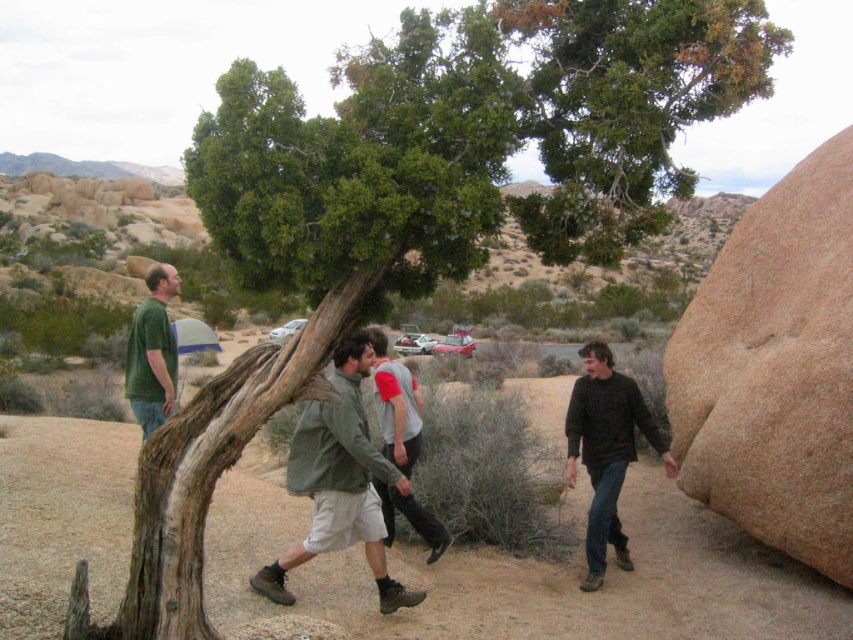
Question: Considering the real-world distances, which object is closest to the green fabric jacket at center?

Choices:
 (A) brown rough rock at right
 (B) dark gray sweater at right
 (C) gray-green fabric jacket at center

Answer: (C)

Question: Is brown rough rock at right below green matte shirt at center?

Choices:
 (A) no
 (B) yes

Answer: (B)

Question: Can you confirm if brown rough rock at right is positioned above green fabric jacket at center?

Choices:
 (A) no
 (B) yes

Answer: (B)

Question: Based on their relative distances, which object is farther from the dark gray sweater at right?

Choices:
 (A) green matte shirt at center
 (B) gray-green fabric jacket at center
 (C) green fabric jacket at center

Answer: (A)

Question: Which object appears farthest from the camera in this image?

Choices:
 (A) brown rough rock at right
 (B) green matte shirt at center
 (C) green fabric jacket at center
 (D) gray-green fabric jacket at center

Answer: (B)

Question: Is dark gray sweater at right thinner than gray-green fabric jacket at center?

Choices:
 (A) no
 (B) yes

Answer: (A)